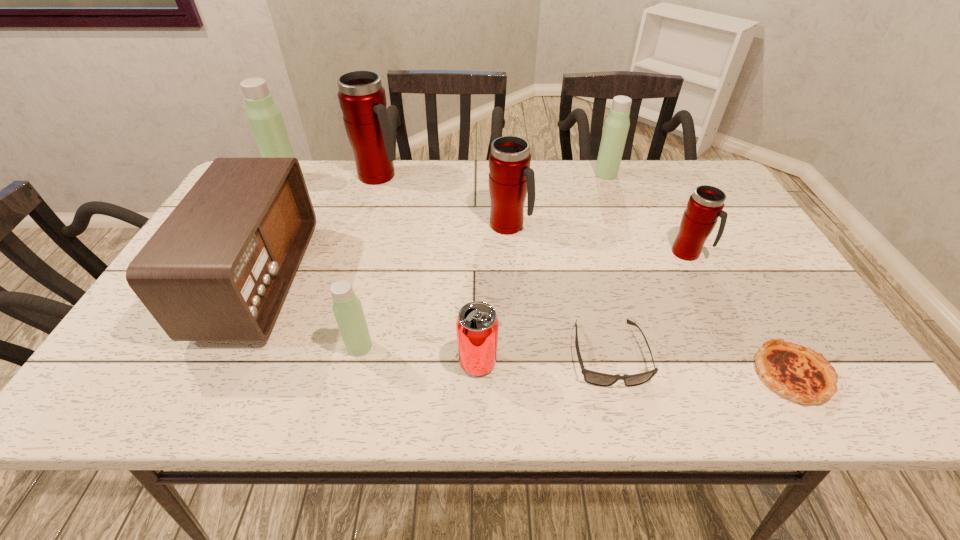
What are the coordinates of `the third closest object relative to the second smallest red thermos bottle` in the screenshot? It's located at (362, 99).

Where is `object that is the second closest one to the red soda can`? This screenshot has height=540, width=960. object that is the second closest one to the red soda can is located at coordinates (347, 308).

Where is `thermos bottle that is the third closest to the fifth farthest thermos bottle`? This screenshot has width=960, height=540. thermos bottle that is the third closest to the fifth farthest thermos bottle is located at coordinates (347, 308).

Locate which thermos bottle ranks in proximity to the eighth tallest object. Please provide its 2D coordinates. Your answer should be formatted as a tuple, i.e. [(x, y)], where the tuple contains the x and y coordinates of a point satisfying the conditions above.

[(347, 308)]

Choose which light thermos bottle is the third nearest neighbor to the smallest red thermos bottle. Please provide its 2D coordinates. Your answer should be formatted as a tuple, i.e. [(x, y)], where the tuple contains the x and y coordinates of a point satisfying the conditions above.

[(265, 119)]

Identify which light thermos bottle is the nearest to the radio receiver. Please provide its 2D coordinates. Your answer should be formatted as a tuple, i.e. [(x, y)], where the tuple contains the x and y coordinates of a point satisfying the conditions above.

[(347, 308)]

This screenshot has width=960, height=540. Identify the location of red thermos bottle that is the second closest to the nearest light thermos bottle. (362, 99).

Where is `red thermos bottle that is the second closest to the second biggest light thermos bottle`? This screenshot has height=540, width=960. red thermos bottle that is the second closest to the second biggest light thermos bottle is located at coordinates (704, 207).

Find the location of a particular element. The height and width of the screenshot is (540, 960). free location that satisfies the following two spatial constraints: 1. on the front-facing side of the fourth object from right to left; 2. on the left side of the shortest object is located at coordinates (613, 374).

Identify the location of free point that satisfies the following two spatial constraints: 1. on the front-facing side of the nearest thermos bottle; 2. on the right side of the brown radio receiver. This screenshot has width=960, height=540. (227, 346).